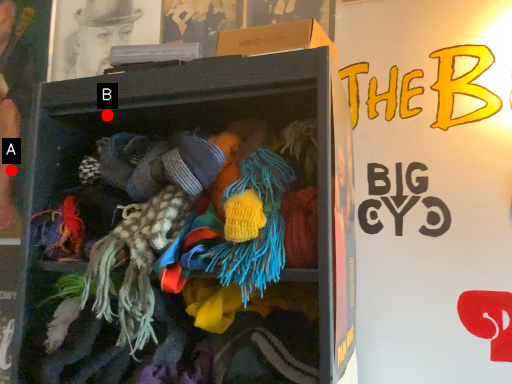
Question: Two points are circled on the image, labeled by A and B beside each circle. Which of the following is the closest to the observer?

Choices:
 (A) A is closer
 (B) B is closer

Answer: (B)